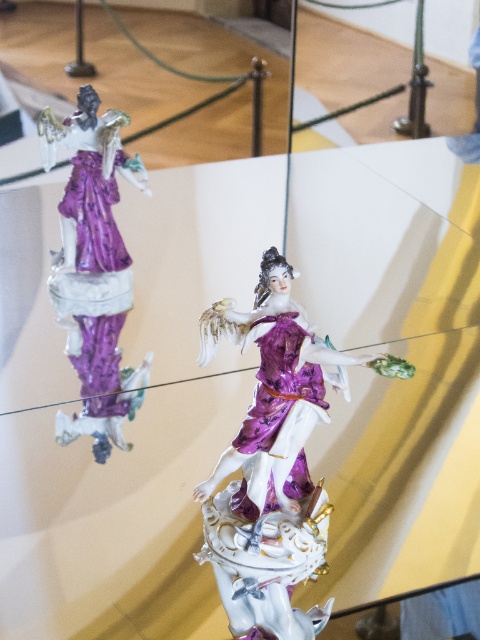
Which is behind, point (218, 547) or point (79, 220)?

Point (79, 220)

Which of these two, porcelain statue at center or porcelain statue at left, stands shorter?

Standing shorter between the two is porcelain statue at center.

Image resolution: width=480 pixels, height=640 pixels. Identify the location of porcelain statue at center. (274, 461).

At what (x,y) coordinates should I click in order to perform the action: click on porcelain statue at center. Please return your answer as a coordinate pair (x, y). The height and width of the screenshot is (640, 480). Looking at the image, I should click on (274, 461).

Who is positioned more to the left, porcelain statue at left or matte porcelain dress at center?

porcelain statue at left

Image resolution: width=480 pixels, height=640 pixels. In order to click on porcelain statue at left in this screenshot , I will do `click(93, 266)`.

The image size is (480, 640). I want to click on porcelain statue at left, so click(x=93, y=266).

Between porcelain statue at center and matte porcelain dress at center, which one is positioned higher?

matte porcelain dress at center is above.

Image resolution: width=480 pixels, height=640 pixels. What do you see at coordinates (274, 461) in the screenshot?
I see `porcelain statue at center` at bounding box center [274, 461].

You are a GUI agent. You are given a task and a screenshot of the screen. Output one action in this format:
    pyautogui.click(x=<x>, y=<y>)
    Task: Click on the porcelain statue at center
    This screenshot has width=480, height=640.
    Given the screenshot: What is the action you would take?
    pyautogui.click(x=274, y=461)

At what (x,y) coordinates should I click in order to perform the action: click on porcelain statue at center. Please return your answer as a coordinate pair (x, y). Image resolution: width=480 pixels, height=640 pixels. Looking at the image, I should click on (274, 461).